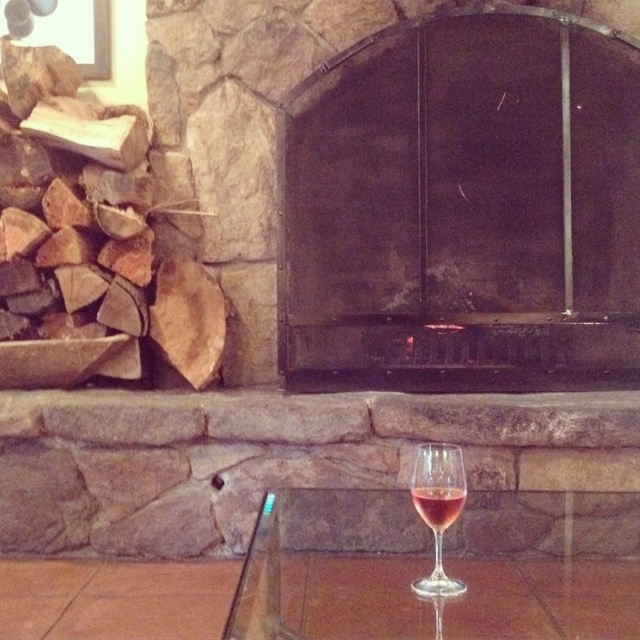
Question: Which of the following is the closest to the observer?

Choices:
 (A) dark stone fireplace at center
 (B) clear glass wine glass at center
 (C) transparent glass table at lower center

Answer: (C)

Question: Which of the following is the closest to the observer?

Choices:
 (A) (433, 496)
 (B) (461, 461)

Answer: (A)

Question: Is transparent glass table at lower center behind rosy glass at lower center?

Choices:
 (A) yes
 (B) no

Answer: (B)

Question: Can you confirm if transparent glass table at lower center is smaller than rosy glass at lower center?

Choices:
 (A) no
 (B) yes

Answer: (A)

Question: Is dark stone fireplace at center behind clear glass wine glass at center?

Choices:
 (A) no
 (B) yes

Answer: (B)

Question: Which point appears farthest from the camera in this image?

Choices:
 (A) (536, 584)
 (B) (433, 509)

Answer: (A)